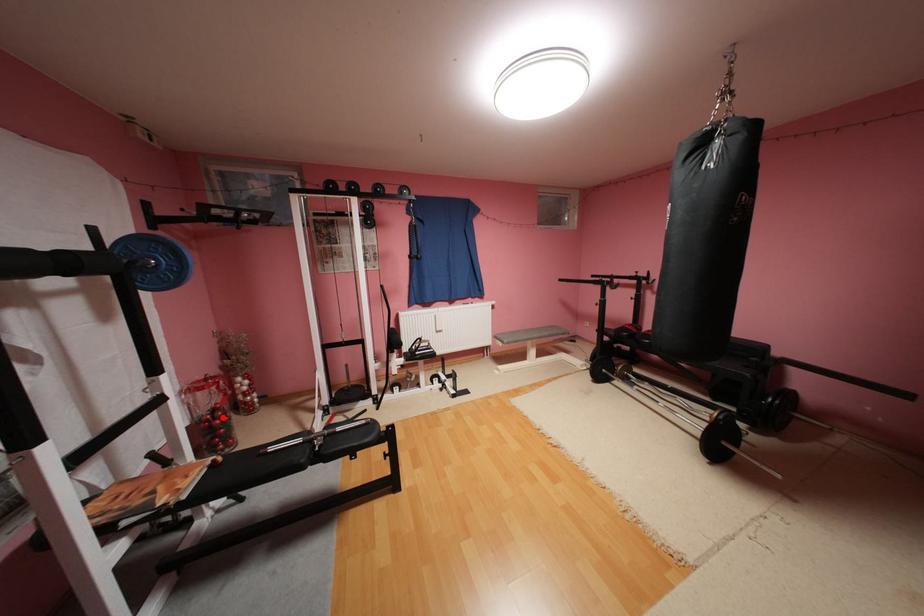
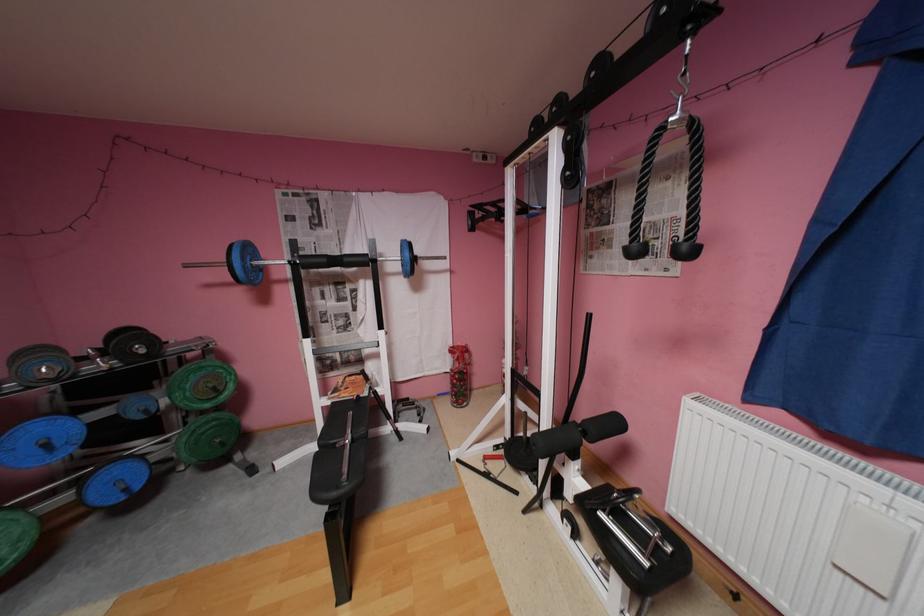
Question: A red point is marked in image1. In image2, is the corresponding 3D point closer to the camera or farther? Reply with the corresponding letter.

Choices:
 (A) The corresponding 3D point is closer.
 (B) The corresponding 3D point is farther.

Answer: (B)